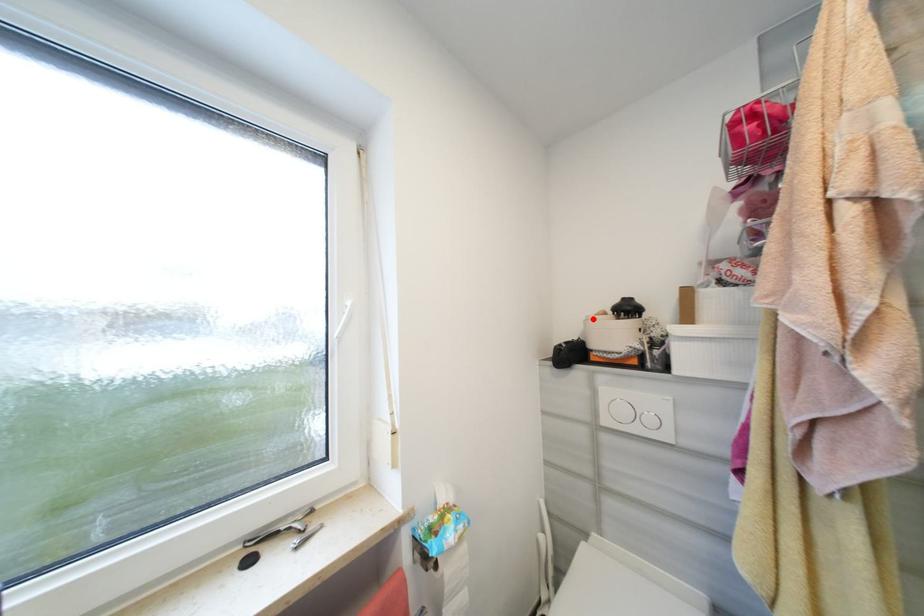
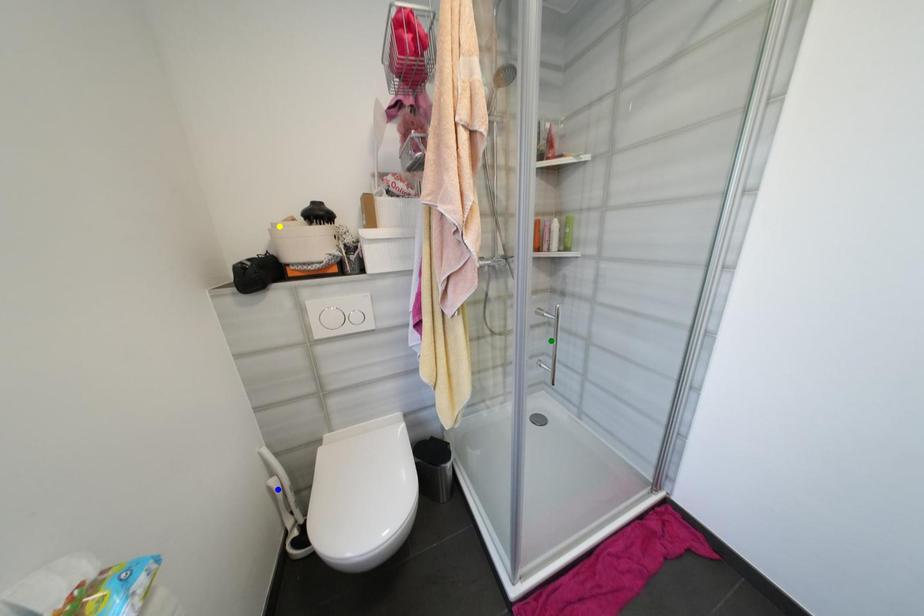
Question: I am providing you with two images of the same scene from different viewpoints. A red point is marked on the first image. You are given multiple points on the second image. Can you choose the point in image 2 that corresponds to the point in image 1?

Choices:
 (A) yellow point
 (B) blue point
 (C) green point

Answer: (A)